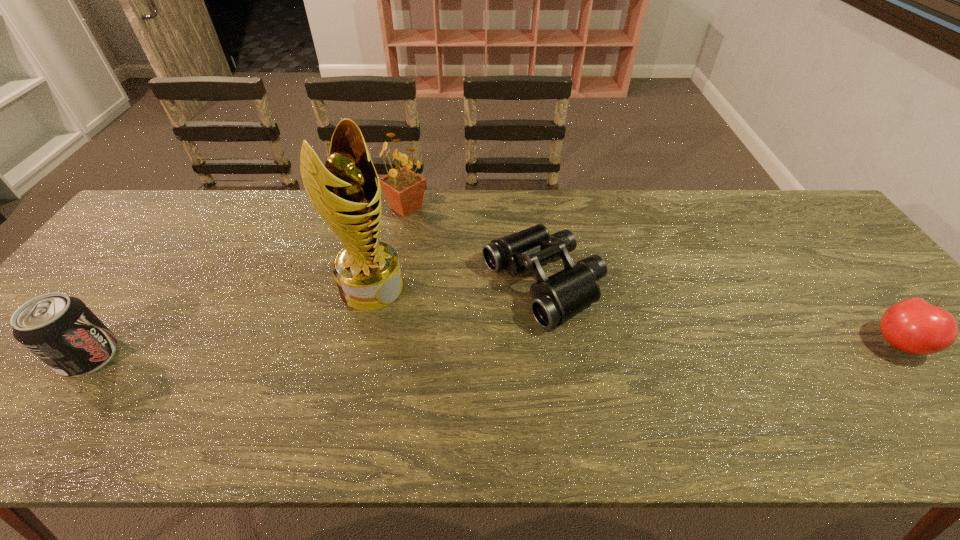
Find the location of a particular element. The height and width of the screenshot is (540, 960). empty space that is in between the tallest object and the leftmost object is located at coordinates (230, 321).

Image resolution: width=960 pixels, height=540 pixels. Identify the location of vacant area that lies between the leftmost object and the award. (230, 321).

What are the coordinates of `vacant space that is in between the fourth shortest object and the soda can` in the screenshot? It's located at pyautogui.click(x=248, y=282).

Identify the location of free space between the second tallest object and the apple. (653, 275).

The height and width of the screenshot is (540, 960). In order to click on free space between the fourth shortest object and the third shortest object in this screenshot , I will do `click(248, 282)`.

The height and width of the screenshot is (540, 960). Find the location of `vacant space that is in between the rightmost object and the tallest object`. vacant space that is in between the rightmost object and the tallest object is located at coordinates (636, 315).

Locate an element on the screen. The width and height of the screenshot is (960, 540). unoccupied area between the rightmost object and the soda can is located at coordinates (494, 350).

Find the location of a particular element. The image size is (960, 540). object that ranks as the fourth closest to the apple is located at coordinates (60, 330).

Identify which object is the fourth nearest to the apple. Please provide its 2D coordinates. Your answer should be formatted as a tuple, i.e. [(x, y)], where the tuple contains the x and y coordinates of a point satisfying the conditions above.

[(60, 330)]

This screenshot has width=960, height=540. Find the location of `free space that satisfies the following two spatial constraints: 1. on the back side of the binoculars; 2. on the left side of the soda can`. free space that satisfies the following two spatial constraints: 1. on the back side of the binoculars; 2. on the left side of the soda can is located at coordinates (142, 285).